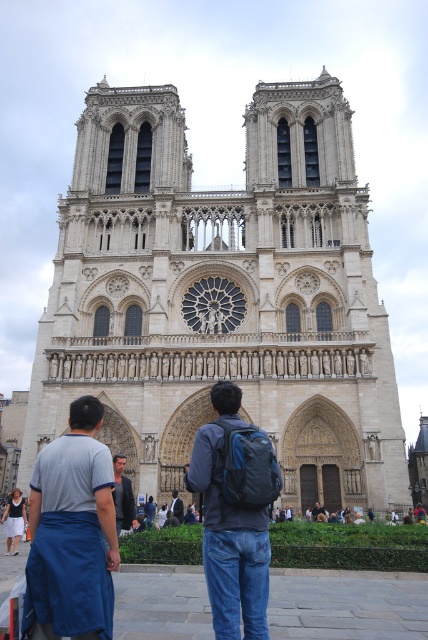
You are an artist standing in front of the Notre Dame Cathedral and you want to sketch the scene. You notice two items at the lower left corner of your drawing. Which one is narrower between the blue fabric apron at lower left and the white cotton skirt at lower left?

The blue fabric apron at lower left is narrower than the white cotton skirt at lower left.

You are standing in front of the white stone cathedral at center and want to take a photo that includes both it and the white cotton skirt at lower left. Given their sizes, which object should you position closer to the camera to ensure both are visible in the frame?

The white cotton skirt at lower left is smaller in size, so positioning it closer to the camera will help ensure both the white stone cathedral at center and the white cotton skirt at lower left fit into the frame.

In the scene shown: You are an artist who wants to sketch the Notre Dame Cathedral. You have a blue fabric apron at lower left and a matte blue backpack at center. Which item should you place closer to the edge of your sketchbook to avoid blocking the cathedral facade?

The blue fabric apron at lower left is smaller than the matte blue backpack at center, so placing the blue fabric apron at lower left closer to the edge would take up less space and avoid blocking the cathedral facade.